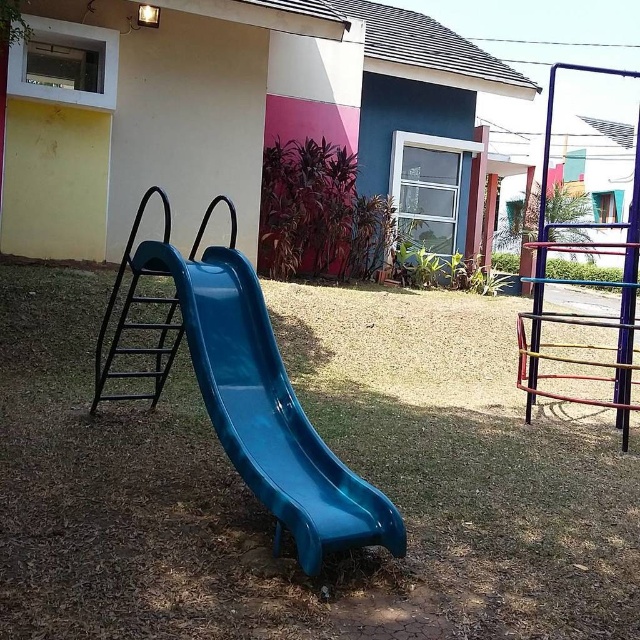
Question: Estimate the real-world distances between objects in this image. Which object is closer to the green grass at center?

Choices:
 (A) black metal ladder at left
 (B) glossy plastic slide at center

Answer: (B)

Question: Which object is the closest to the black metal ladder at left?

Choices:
 (A) green grass at center
 (B) glossy plastic slide at center

Answer: (B)

Question: Which point is farther to the camera?

Choices:
 (A) click(221, 342)
 (B) click(64, 490)
 (C) click(138, 326)

Answer: (C)

Question: Is green grass at center smaller than black metal ladder at left?

Choices:
 (A) yes
 (B) no

Answer: (A)

Question: Is glossy plastic slide at center smaller than black metal ladder at left?

Choices:
 (A) no
 (B) yes

Answer: (A)

Question: Is glossy plastic slide at center wider than black metal ladder at left?

Choices:
 (A) yes
 (B) no

Answer: (A)